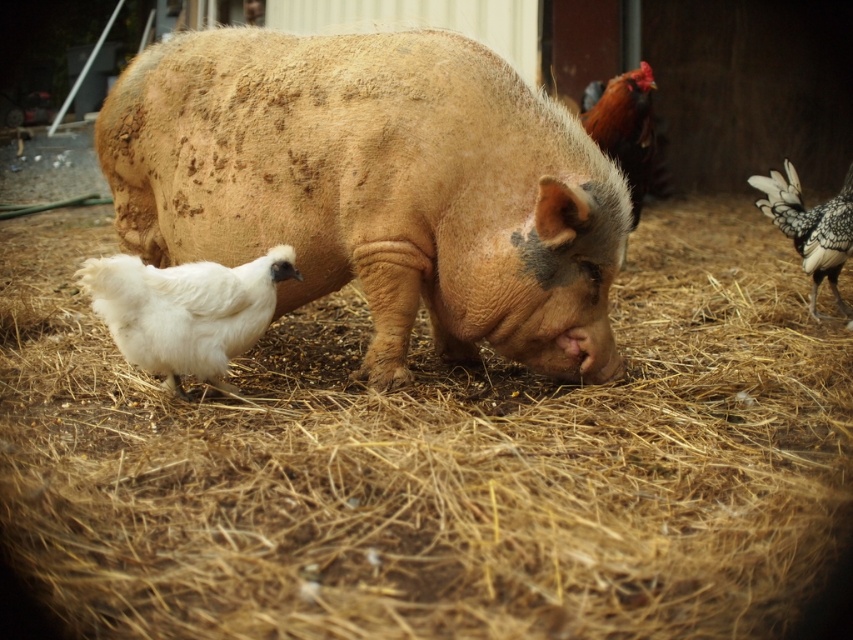
Who is positioned more to the left, brown textured pig at center or white fluffy chicken at lower left?

white fluffy chicken at lower left

Who is more forward, (509, 275) or (177, 304)?

Point (177, 304)

Measure the distance between point (476, 257) and camera.

A distance of 9.24 feet exists between point (476, 257) and camera.

Find the location of a particular element. Image resolution: width=853 pixels, height=640 pixels. brown textured pig at center is located at coordinates (376, 188).

The height and width of the screenshot is (640, 853). What do you see at coordinates (434, 461) in the screenshot?
I see `brown straw at center` at bounding box center [434, 461].

Is brown straw at center bigger than white feathered chicken at right?

Yes, brown straw at center is bigger than white feathered chicken at right.

Is point (45, 260) positioned after point (840, 308)?

Yes, point (45, 260) is behind point (840, 308).

Identify the location of brown straw at center. (434, 461).

Who is taller, brown textured pig at center or white feathered chicken at right?

brown textured pig at center is taller.

Does brown textured pig at center lie behind white feathered chicken at right?

No, it is not.

Does point (254, 68) lie behind point (805, 269)?

No.

At what (x,y) coordinates should I click in order to perform the action: click on brown textured pig at center. Please return your answer as a coordinate pair (x, y). Image resolution: width=853 pixels, height=640 pixels. Looking at the image, I should click on (376, 188).